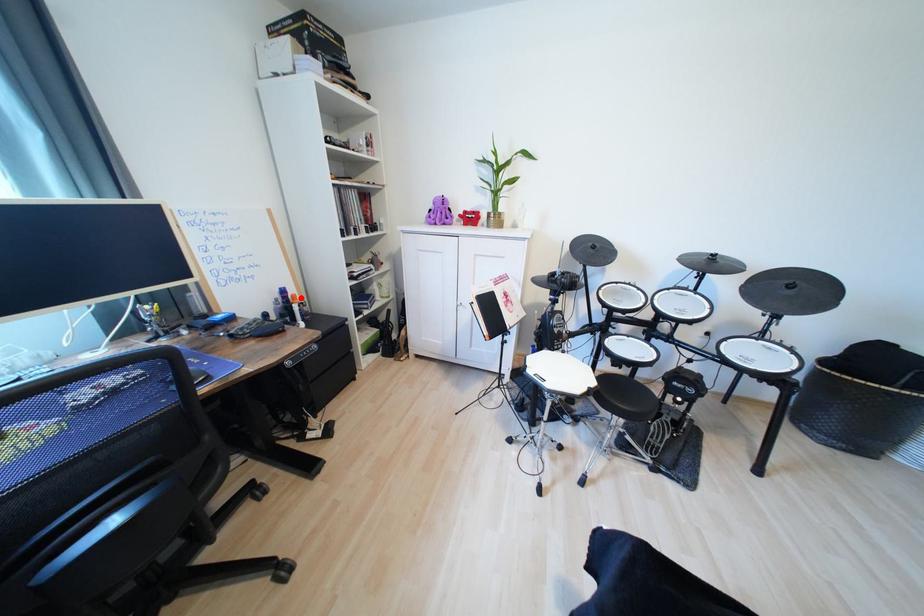
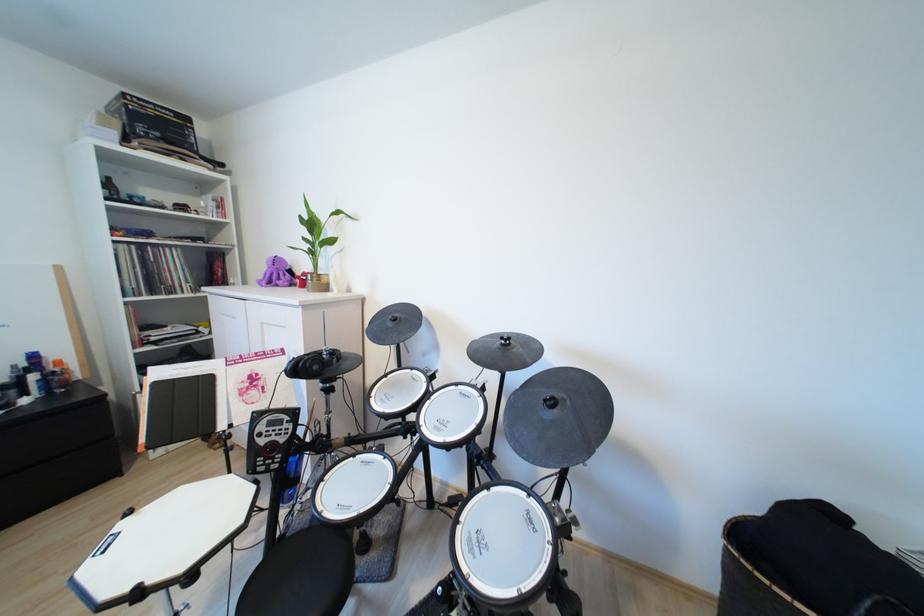
Question: I am providing you with two images of the same scene from different viewpoints. A red point is shown in image1. For the corresponding object point in image2, is it positioned nearer or farther from the camera?

Choices:
 (A) Nearer
 (B) Farther

Answer: (B)